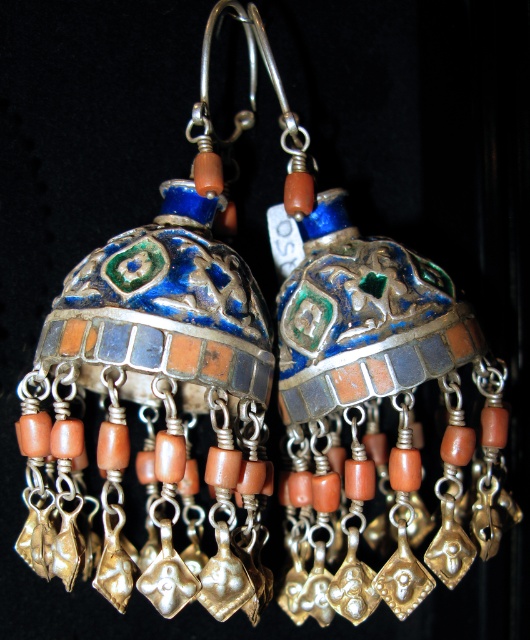
Question: Is enamel/metallic earrings at center closer to the viewer compared to enamel/metallic dome at center?

Choices:
 (A) yes
 (B) no

Answer: (A)

Question: Is enamel/metallic earrings at center smaller than enamel/metallic dome at center?

Choices:
 (A) no
 (B) yes

Answer: (A)

Question: Is enamel/metallic earrings at center positioned behind enamel/metallic dome at center?

Choices:
 (A) no
 (B) yes

Answer: (A)

Question: Which point is closer to the camera?

Choices:
 (A) enamel/metallic dome at center
 (B) enamel/metallic earrings at center

Answer: (B)